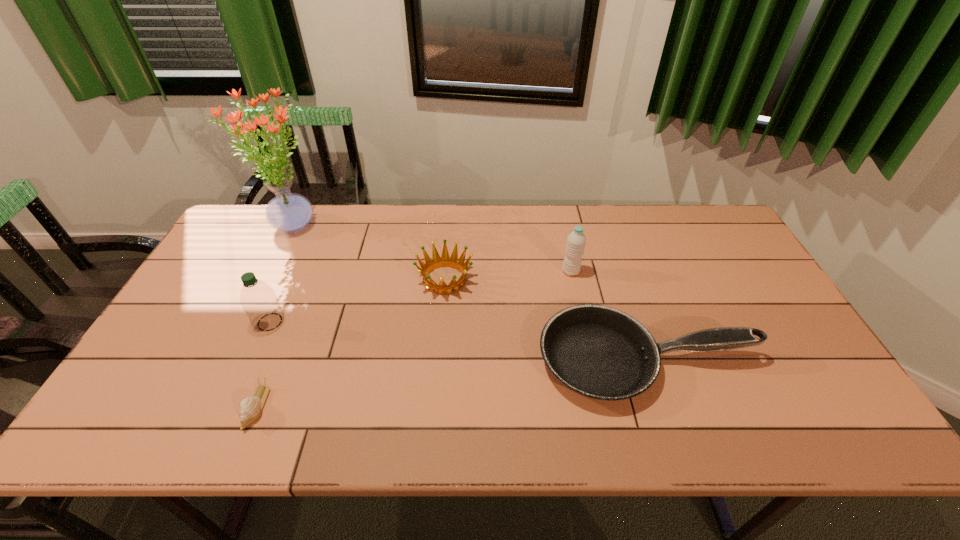
Find the location of a particular element. free spot between the crown and the escargot is located at coordinates [x=350, y=343].

At what (x,y) coordinates should I click in order to perform the action: click on vacant area that lies between the crown and the tallest object. Please return your answer as a coordinate pair (x, y). Looking at the image, I should click on (369, 253).

Locate an element on the screen. object that is the closest to the frying pan is located at coordinates (576, 240).

Find the location of a particular element. This screenshot has width=960, height=540. object identified as the fourth closest to the farthest object is located at coordinates (599, 352).

This screenshot has width=960, height=540. I want to click on free space that satisfies the following two spatial constraints: 1. on the front side of the nearer water bottle; 2. on the left side of the frying pan, so click(252, 360).

Where is `blank area in the image that satisfies the following two spatial constraints: 1. on the front side of the nearer water bottle; 2. on the left side of the flower arrangement`? This screenshot has height=540, width=960. blank area in the image that satisfies the following two spatial constraints: 1. on the front side of the nearer water bottle; 2. on the left side of the flower arrangement is located at coordinates click(x=245, y=322).

Identify the location of vacant area in the image that satisfies the following two spatial constraints: 1. on the front side of the left water bottle; 2. on the right side of the flower arrangement. (245, 322).